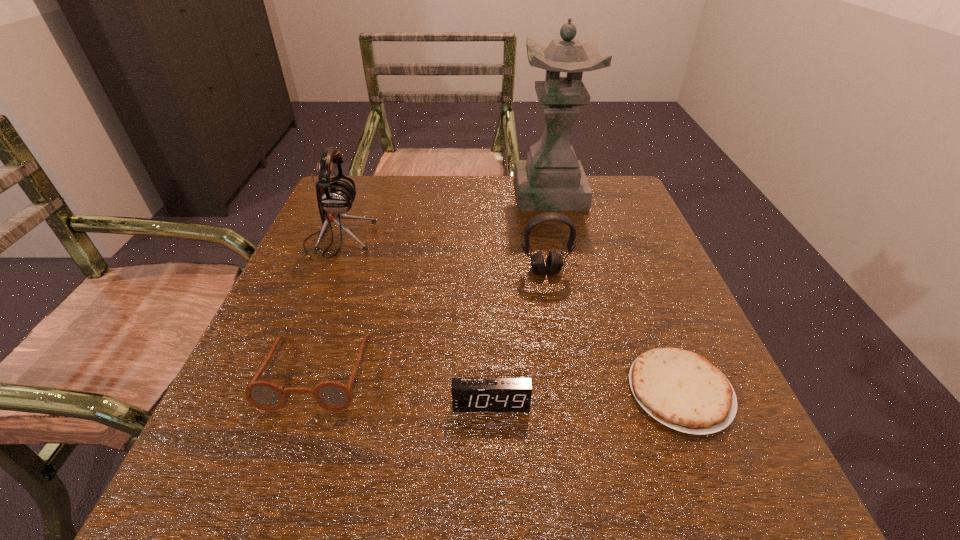
Identify the location of free spot between the spectacles and the fourth nearest object. (431, 321).

Identify which object is the nearest to the fourth nearest object. Please provide its 2D coordinates. Your answer should be formatted as a tuple, i.e. [(x, y)], where the tuple contains the x and y coordinates of a point satisfying the conditions above.

[(683, 390)]

Locate an element on the screen. This screenshot has height=540, width=960. object that is the closest to the tortilla is located at coordinates (468, 394).

Image resolution: width=960 pixels, height=540 pixels. Find the location of `free space that satisfies the following two spatial constraints: 1. at the front opening of the sculpture; 2. on the front-facing side of the headset`. free space that satisfies the following two spatial constraints: 1. at the front opening of the sculpture; 2. on the front-facing side of the headset is located at coordinates (568, 271).

I want to click on blank space that satisfies the following two spatial constraints: 1. on the front-facing side of the tortilla; 2. on the left side of the spectacles, so click(310, 391).

At what (x,y) coordinates should I click in order to perform the action: click on free space that satisfies the following two spatial constraints: 1. on the front-facing side of the fourth shortest object; 2. on the left side of the shortest object. Please return your answer as a coordinate pair (x, y). The image size is (960, 540). Looking at the image, I should click on (566, 391).

This screenshot has height=540, width=960. Find the location of `vacant region that satisfies the following two spatial constraints: 1. at the front opening of the sculpture; 2. on the front-facing side of the headset`. vacant region that satisfies the following two spatial constraints: 1. at the front opening of the sculpture; 2. on the front-facing side of the headset is located at coordinates (568, 271).

Locate an element on the screen. vacant area that satisfies the following two spatial constraints: 1. at the front opening of the sculpture; 2. on the left side of the tortilla is located at coordinates (596, 391).

The width and height of the screenshot is (960, 540). In order to click on free spot that satisfies the following two spatial constraints: 1. on the front-facing side of the fourth shortest object; 2. on the left side of the shortest object in this screenshot , I will do `click(566, 391)`.